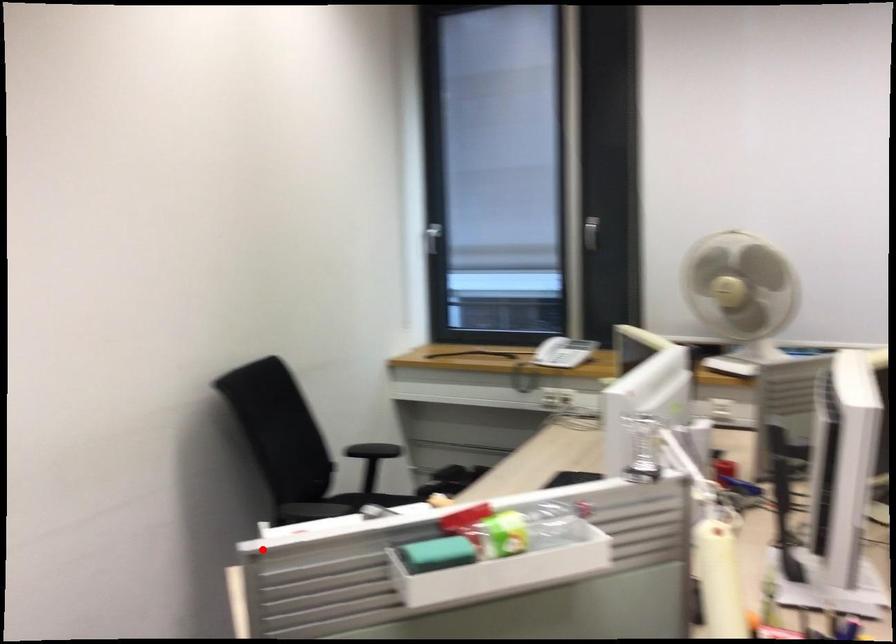
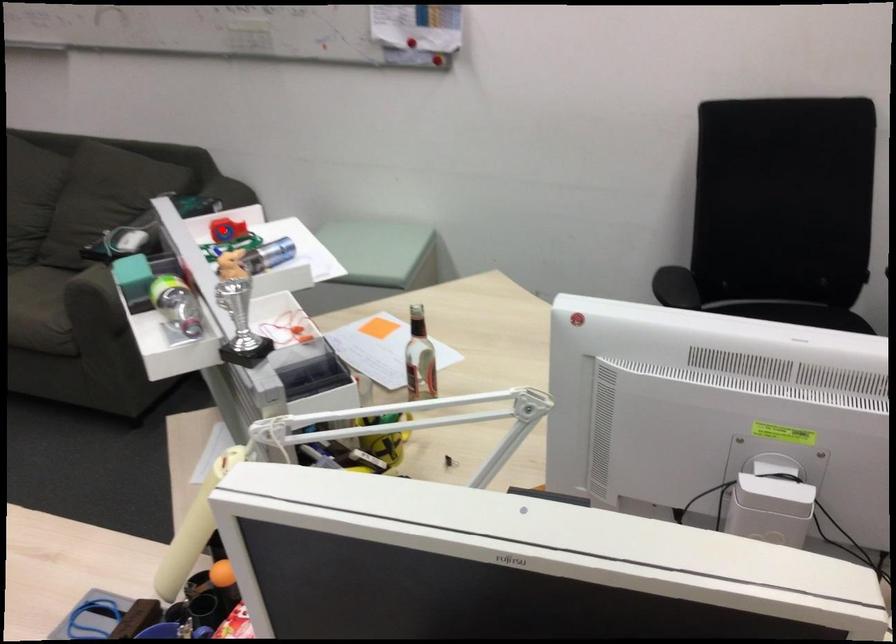
I am providing you with two images of the same scene from different viewpoints. A red point is marked on the first image and another point is marked on the second image. Does the point marked in image1 correspond to the same location as the one in image2?

Yes